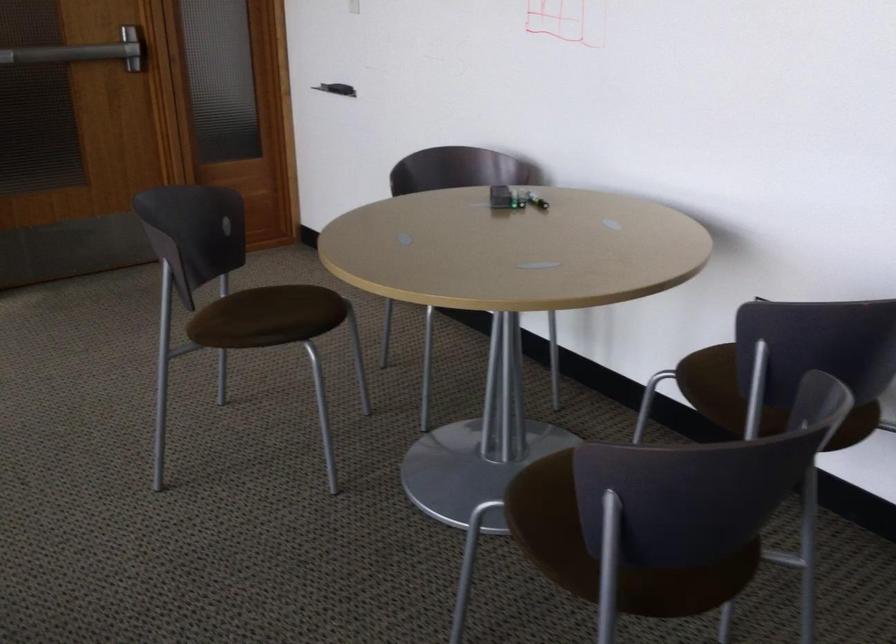
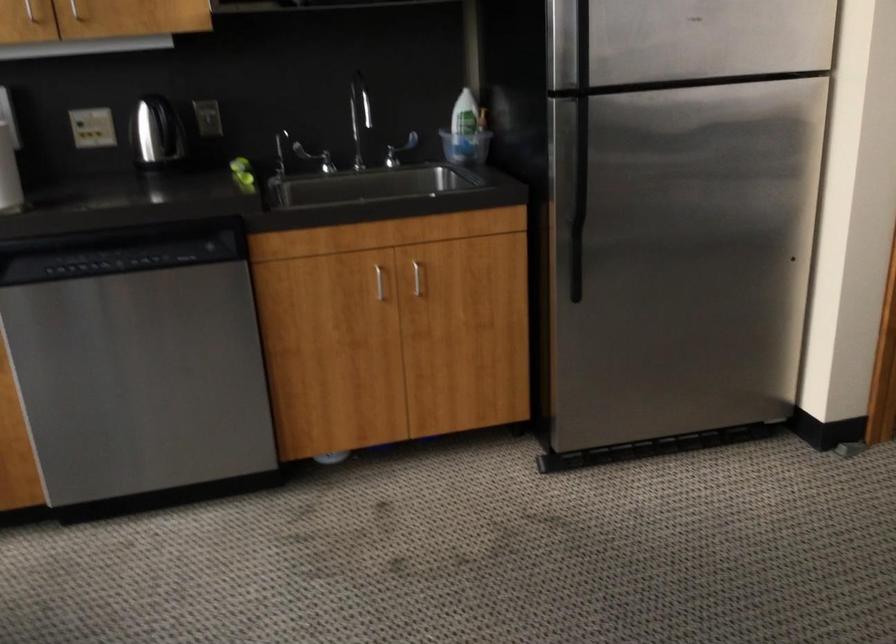
Question: What movement of the cameraman would produce the second image?

Choices:
 (A) Left
 (B) Right
 (C) Forward
 (D) Backward

Answer: (A)